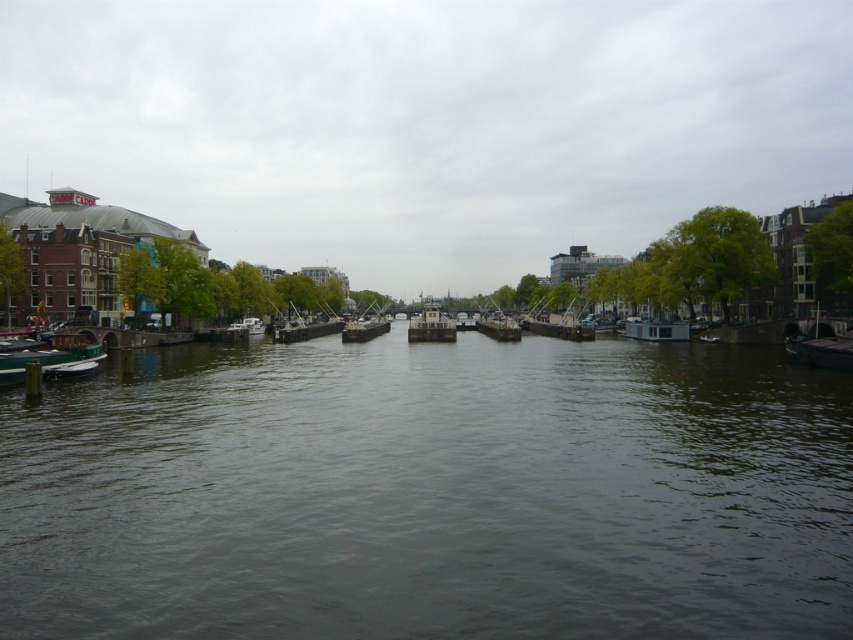
You are an architect designing a new building and want to ensure it fits well with the existing structures in the canal scene. The cloudy sky at center and the green matte boat at lower left are key elements in the composition. Which of these two elements takes up more visual space in the image?

The cloudy sky at center takes up more visual space than the green matte boat at lower left because it is described as bigger.

You are standing at the point with coordinates point (827, 349) and want to walk to the point with coordinates point (25, 352). Is there a direct path between these two points without any obstacles?

The point (25, 352) is behind the point (827, 349), so there is no direct path between them without obstacles.

You are a tour guide explaining the canal boats to visitors. You mention both the green matte boat at lower left and the dark gray metallic boat at right. Which boat would you describe as larger?

The green matte boat at lower left is bigger than the dark gray metallic boat at right.